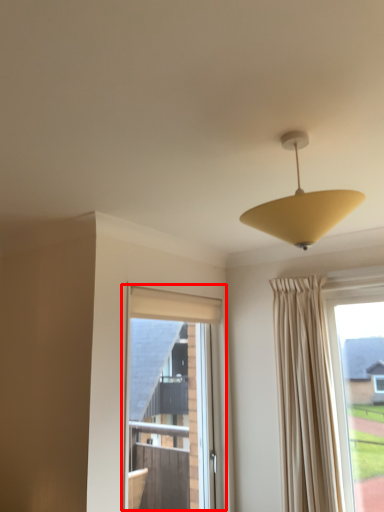
Question: Observing the image, what is the correct spatial positioning of window (annotated by the red box) in reference to lamp?

Choices:
 (A) right
 (B) left

Answer: (B)